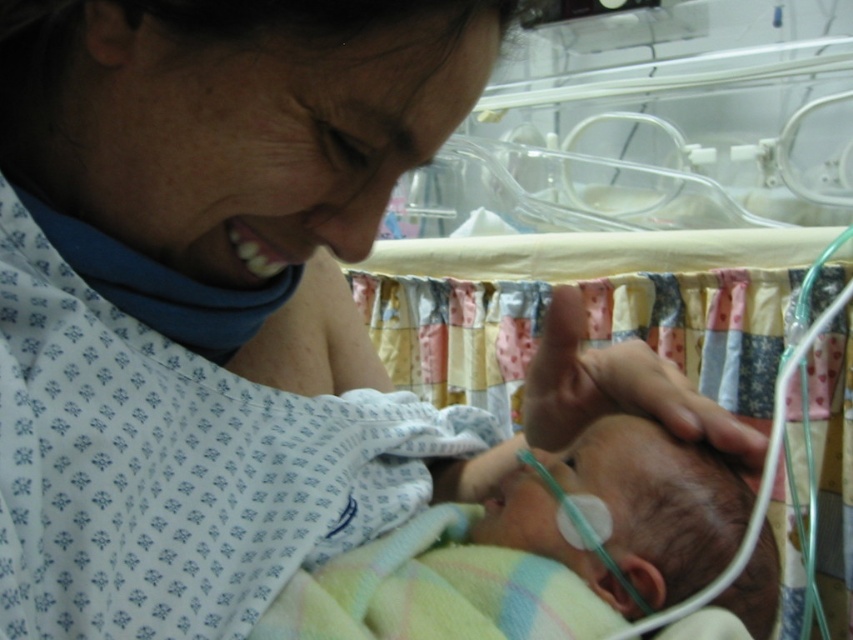
Question: Does patchwork fabric infant bed at center appear under smooth skin newborn at center?

Choices:
 (A) yes
 (B) no

Answer: (B)

Question: Which point is farther to the camera?

Choices:
 (A) (401, 595)
 (B) (457, 372)

Answer: (B)

Question: Is patchwork fabric infant bed at center further to camera compared to smooth skin newborn at center?

Choices:
 (A) no
 (B) yes

Answer: (B)

Question: Among these objects, which one is nearest to the camera?

Choices:
 (A) patchwork fabric infant bed at center
 (B) smooth skin newborn at center

Answer: (B)

Question: From the image, what is the correct spatial relationship of patchwork fabric infant bed at center in relation to smooth skin newborn at center?

Choices:
 (A) above
 (B) below

Answer: (A)